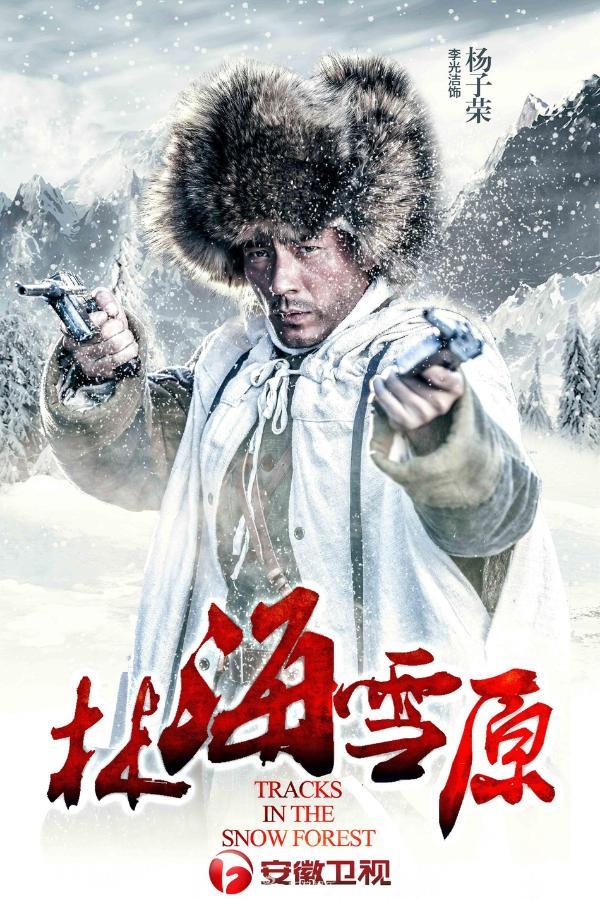
Where is `coat`? This screenshot has height=900, width=600. coat is located at coordinates (332, 502).